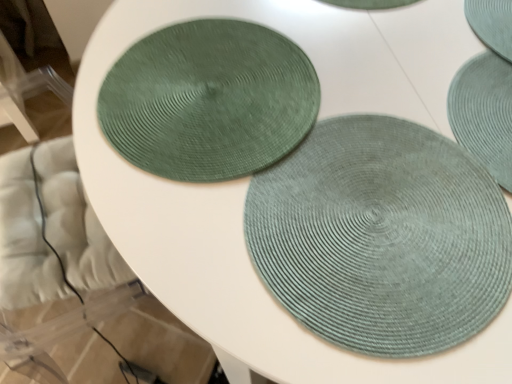
Find the location of a particular element. Image resolution: width=512 pixels, height=384 pixels. vacant area situated below green woven coaster at upper left, the 1th coaster when ordered from left to right (from a real-world perspective) is located at coordinates point(224,90).